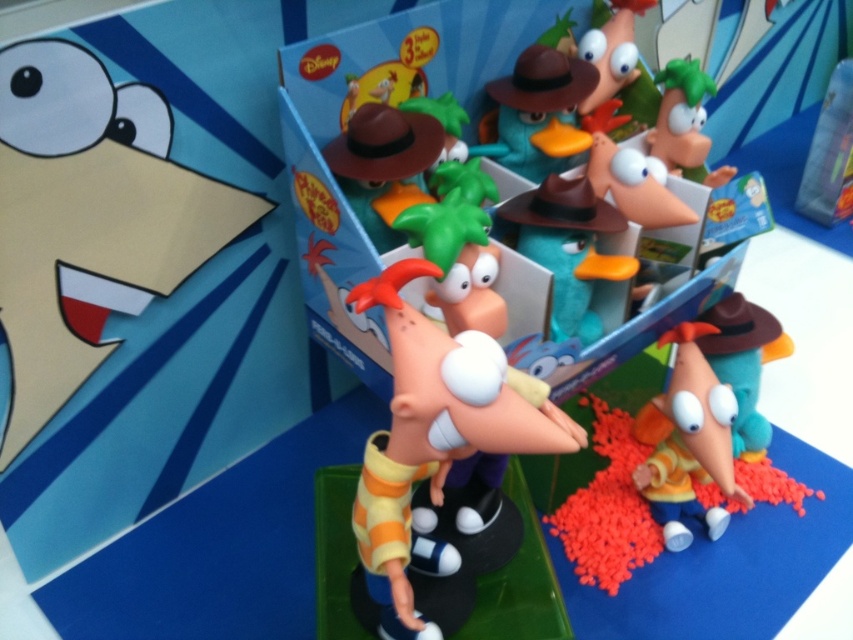
Does yellow matte duck at upper left appear over yellow matte toy at center?

Yes, yellow matte duck at upper left is above yellow matte toy at center.

Measure the distance between yellow matte duck at upper left and camera.

The distance of yellow matte duck at upper left from camera is 30.82 inches.

Is point (187, 218) farther from viewer compared to point (659, 458)?

No, it is not.

The height and width of the screenshot is (640, 853). Find the location of `yellow matte duck at upper left`. yellow matte duck at upper left is located at coordinates (88, 216).

Does yellow matte duck at upper left appear under matte brown hat at upper center?

Indeed, yellow matte duck at upper left is positioned under matte brown hat at upper center.

Can you confirm if yellow matte duck at upper left is wider than matte brown hat at upper center?

Yes, yellow matte duck at upper left is wider than matte brown hat at upper center.

Locate an element on the screen. The height and width of the screenshot is (640, 853). yellow matte duck at upper left is located at coordinates (88, 216).

Where is `yellow matte duck at upper left`? yellow matte duck at upper left is located at coordinates (88, 216).

Is matte plastic toy at center wider than yellow matte toy at center?

Correct, the width of matte plastic toy at center exceeds that of yellow matte toy at center.

Between point (448, 432) and point (689, 509), which one is positioned behind?

The point (689, 509) is more distant.

Where is `matte plastic toy at center`? The height and width of the screenshot is (640, 853). matte plastic toy at center is located at coordinates (434, 433).

At what (x,y) coordinates should I click in order to perform the action: click on matte plastic toy at center. Please return your answer as a coordinate pair (x, y). This screenshot has width=853, height=640. Looking at the image, I should click on (434, 433).